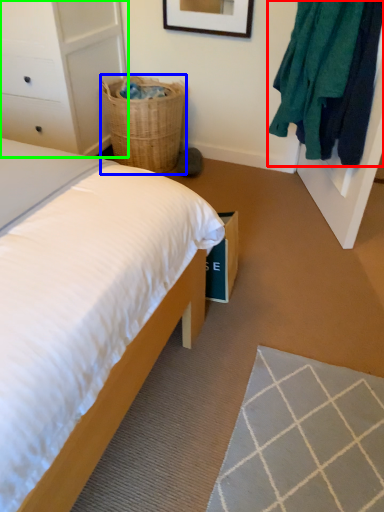
Question: Which object is the closest to the clothing (highlighted by a red box)? Choose among these: basket (highlighted by a blue box) or dresser (highlighted by a green box).

Choices:
 (A) basket
 (B) dresser

Answer: (A)